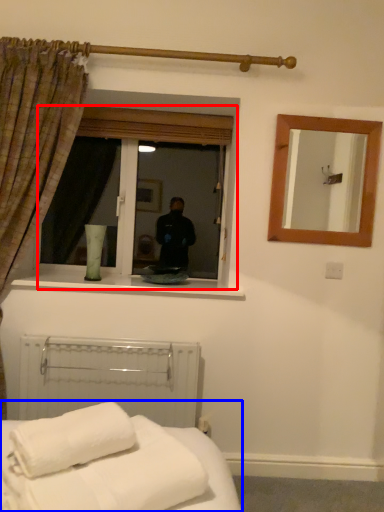
Question: Which object is closer to the camera taking this photo, window (highlighted by a red box) or bed (highlighted by a blue box)?

Choices:
 (A) window
 (B) bed

Answer: (B)